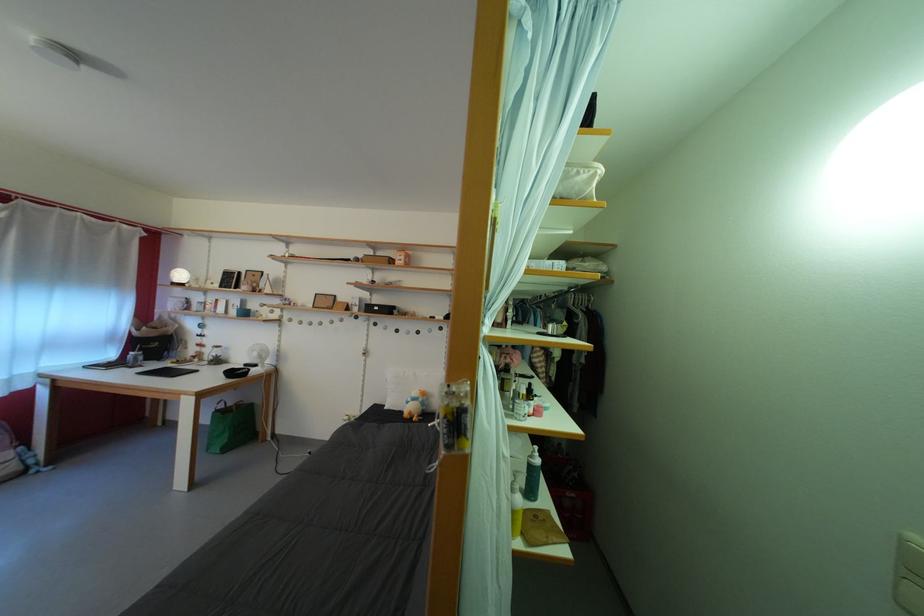
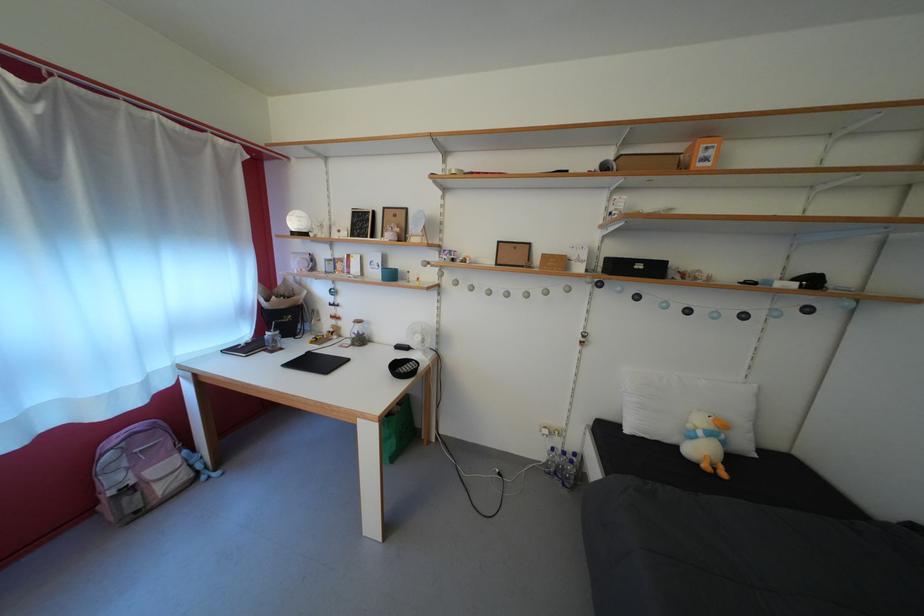
Where in the second image is the point corresponding to point 263,360 from the first image?

(427, 344)